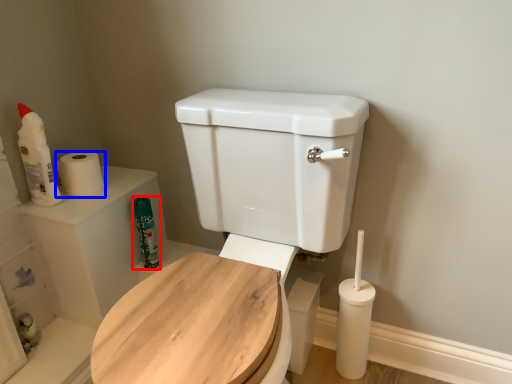
Question: Which point is further to the camera, cleaning product (highlighted by a red box) or toilet paper (highlighted by a blue box)?

Choices:
 (A) cleaning product
 (B) toilet paper

Answer: (A)